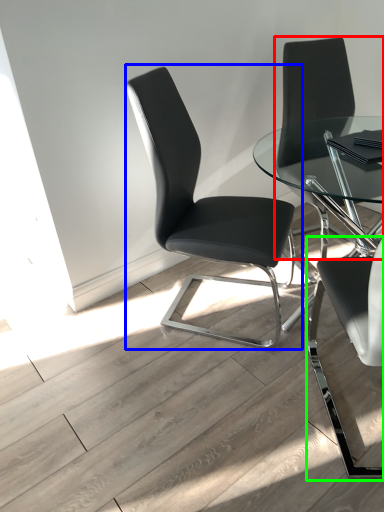
Question: Considering the real-world distances, which object is farthest from chair (highlighted by a red box)? chair (highlighted by a blue box) or chair (highlighted by a green box)?

Choices:
 (A) chair
 (B) chair

Answer: (B)